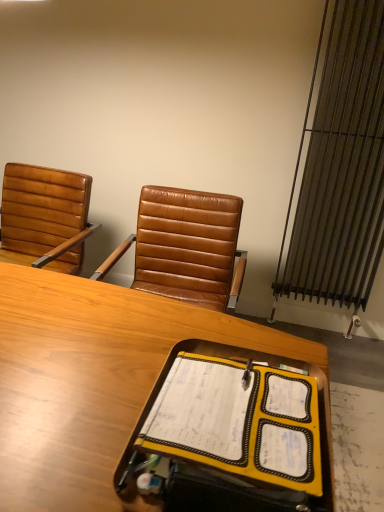
Locate an element on the screen. The width and height of the screenshot is (384, 512). wooden desk at center is located at coordinates (91, 379).

Describe the element at coordinates (91, 379) in the screenshot. Image resolution: width=384 pixels, height=512 pixels. I see `wooden desk at center` at that location.

This screenshot has width=384, height=512. Find the location of `metallic silver radiator at right`. metallic silver radiator at right is located at coordinates click(341, 168).

I want to click on wooden desk at center, so click(x=91, y=379).

Is yellow fabric notebook at center next to wooden desk at center and touching it?

There is a gap between yellow fabric notebook at center and wooden desk at center.

Does yellow fabric notebook at center have a lesser width compared to wooden desk at center?

Indeed, yellow fabric notebook at center has a lesser width compared to wooden desk at center.

Is yellow fabric notebook at center facing towards wooden desk at center?

No, yellow fabric notebook at center is not oriented towards wooden desk at center.

From their relative heights in the image, would you say yellow fabric notebook at center is taller or shorter than wooden desk at center?

In the image, yellow fabric notebook at center appears to be shorter than wooden desk at center.

Based on the photo, considering the relative positions of brown leather chair at left and wooden desk at center in the image provided, is brown leather chair at left behind wooden desk at center?

That is True.

Is point (48, 250) positioned behind point (116, 298)?

Yes, it is behind point (116, 298).

Is brown leather chair at left spatially inside wooden desk at center, or outside of it?

brown leather chair at left is not inside wooden desk at center, it's outside.

Looking at this image, how many degrees apart are the facing directions of brown leather chair at left and wooden desk at center?

brown leather chair at left and wooden desk at center are facing 2.74 degrees away from each other.

Find the location of `desk below the metallic silver radiator at right (from the image's perspective)`. desk below the metallic silver radiator at right (from the image's perspective) is located at coordinates (91, 379).

Which object is wider, metallic silver radiator at right or wooden desk at center?

With larger width is wooden desk at center.

How much distance is there between metallic silver radiator at right and wooden desk at center?

metallic silver radiator at right is 4.72 feet away from wooden desk at center.

Between metallic silver radiator at right and wooden desk at center, which one has more height?

metallic silver radiator at right.

In order to click on notebook above the wooden desk at center (from a real-world perspective) in this screenshot , I will do `click(238, 421)`.

Is wooden desk at center at the left side of yellow fabric notebook at center?

Correct, you'll find wooden desk at center to the left of yellow fabric notebook at center.

Which of these two, wooden desk at center or yellow fabric notebook at center, stands shorter?

yellow fabric notebook at center.

From a real-world perspective, relative to yellow fabric notebook at center, is wooden desk at center vertically above or below?

From a real-world perspective, wooden desk at center is physically below yellow fabric notebook at center.

Is brown leather chair at left facing away from yellow fabric notebook at center?

That's not correct — brown leather chair at left is not looking away from yellow fabric notebook at center.

Is brown leather chair at left closer to the viewer compared to yellow fabric notebook at center?

No, the depth of brown leather chair at left is greater than that of yellow fabric notebook at center.

From a real-world perspective, which object stands above the other?

In real-world perspective, yellow fabric notebook at center is above.

From the image's perspective, relative to yellow fabric notebook at center, is brown leather chair at left above or below?

brown leather chair at left is situated higher than yellow fabric notebook at center in the image.

Does metallic silver radiator at right have a greater width compared to brown leather chair at left?

Incorrect, the width of metallic silver radiator at right does not surpass that of brown leather chair at left.

Which of these two, metallic silver radiator at right or brown leather chair at left, is bigger?

brown leather chair at left.

From the image's perspective, would you say metallic silver radiator at right is shown under brown leather chair at left?

No.

Considering the positions of points (374, 236) and (54, 203), is point (374, 236) closer to camera compared to point (54, 203)?

No, it is behind (54, 203).

Is point (25, 174) farther from viewer compared to point (353, 263)?

No, (25, 174) is in front of (353, 263).

In terms of width, does brown leather chair at left look wider or thinner when compared to metallic silver radiator at right?

Clearly, brown leather chair at left has more width compared to metallic silver radiator at right.

Where is `radiator behind the brown leather chair at left`? This screenshot has width=384, height=512. radiator behind the brown leather chair at left is located at coordinates (341, 168).

Is metallic silver radiator at right at the back of brown leather chair at left?

No.

Where is `notebook behind the wooden desk at center`? The image size is (384, 512). notebook behind the wooden desk at center is located at coordinates (238, 421).

I want to click on chair on the left of wooden desk at center, so click(44, 217).

Based on their spatial positions, is brown leather chair at left or wooden desk at center further from yellow fabric notebook at center?

The object further to yellow fabric notebook at center is brown leather chair at left.

Which object lies further to the anchor point wooden desk at center, metallic silver radiator at right or yellow fabric notebook at center?

metallic silver radiator at right is further to wooden desk at center.

Based on their spatial positions, is wooden desk at center or brown leather chair at left further from metallic silver radiator at right?

Based on the image, wooden desk at center appears to be further to metallic silver radiator at right.

Looking at the image, which one is located further to wooden desk at center, yellow fabric notebook at center or metallic silver radiator at right?

metallic silver radiator at right is further to wooden desk at center.

Looking at the image, which one is located further to yellow fabric notebook at center, wooden desk at center or metallic silver radiator at right?

Among the two, metallic silver radiator at right is located further to yellow fabric notebook at center.

Which object lies further to the anchor point wooden desk at center, yellow fabric notebook at center or brown leather chair at left?

Based on the image, brown leather chair at left appears to be further to wooden desk at center.

Based on their spatial positions, is brown leather chair at left or metallic silver radiator at right further from yellow fabric notebook at center?

The object further to yellow fabric notebook at center is metallic silver radiator at right.

From the image, which object appears to be farther from brown leather chair at left, wooden desk at center or yellow fabric notebook at center?

yellow fabric notebook at center is further to brown leather chair at left.

This screenshot has width=384, height=512. Find the location of `notebook between wooden desk at center and metallic silver radiator at right along the z-axis`. notebook between wooden desk at center and metallic silver radiator at right along the z-axis is located at coordinates (238, 421).

Find the location of a particular element. notebook located between brown leather chair at left and metallic silver radiator at right in the left-right direction is located at coordinates (238, 421).

In order to click on notebook between wooden desk at center and brown leather chair at left along the z-axis in this screenshot , I will do `click(238, 421)`.

Identify the location of desk situated between brown leather chair at left and metallic silver radiator at right from left to right. (91, 379).